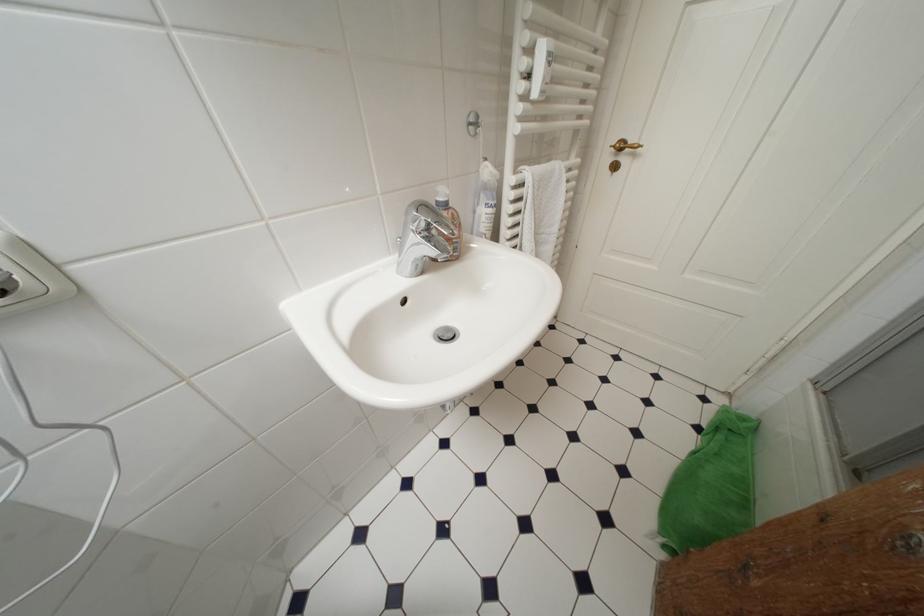
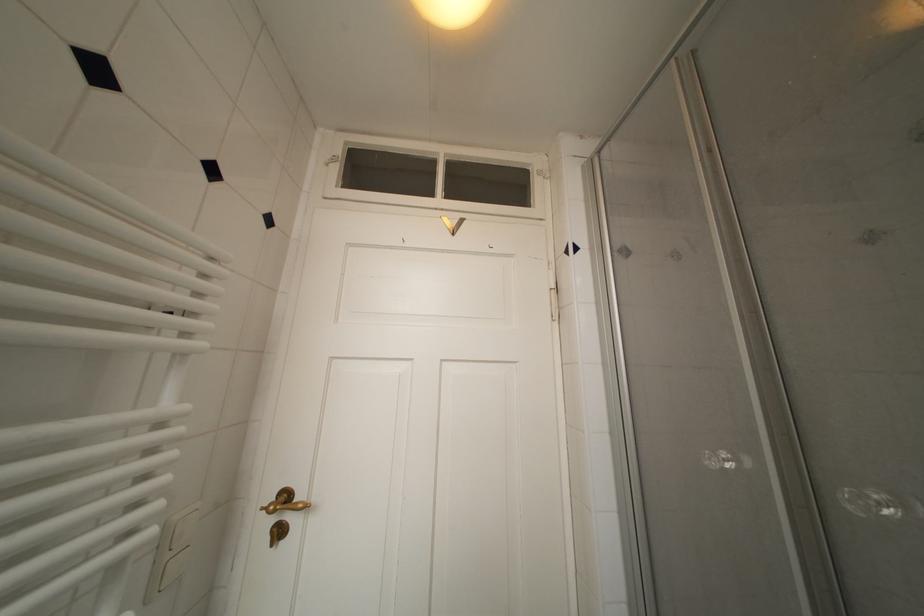
In the second image, find the point that corresponds to pixel 617 163 in the first image.

(280, 524)